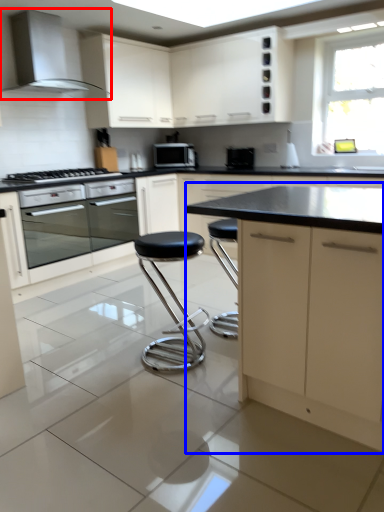
Question: Which of the following is the farthest to the observer, home appliance (highlighted by a red box) or cabinetry (highlighted by a blue box)?

Choices:
 (A) home appliance
 (B) cabinetry

Answer: (A)